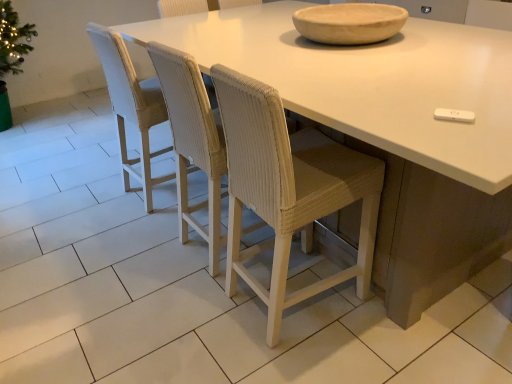
Question: Looking at the image, does white woven chair at center, the fourth chair from the left, seem bigger or smaller compared to natural wood bowl at upper center?

Choices:
 (A) small
 (B) big

Answer: (B)

Question: From their relative heights in the image, would you say white woven chair at center, the fourth chair from the left, is taller or shorter than natural wood bowl at upper center?

Choices:
 (A) tall
 (B) short

Answer: (A)

Question: Which object is the closest to the woven white chair at center, marked as the second chair in a right-to-left arrangement?

Choices:
 (A) white matte table at center
 (B) woven white chair at left, the fourth chair from the right
 (C) white woven chair at center, which appears as the 1th chair when viewed from the right
 (D) natural wood bowl at upper center
 (E) woven white chair at center, the third chair from the right

Answer: (E)

Question: Estimate the real-world distances between objects in this image. Which object is closer to the woven white chair at center, the third chair from the right?

Choices:
 (A) white matte table at center
 (B) woven white chair at left, which is the 1th chair in left-to-right order
 (C) white woven chair at center, the fourth chair from the left
 (D) woven white chair at center, marked as the second chair in a right-to-left arrangement
 (E) natural wood bowl at upper center

Answer: (D)